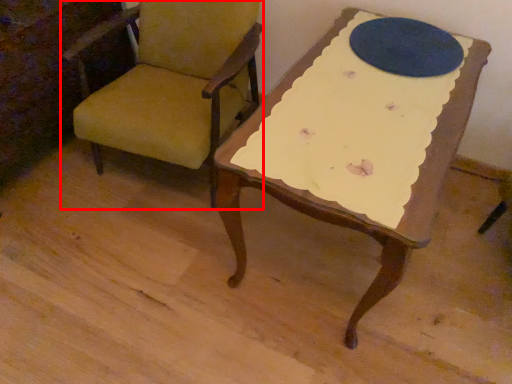
Question: Considering the relative positions of chair (annotated by the red box) and oval in the image provided, where is chair (annotated by the red box) located with respect to the staircase?

Choices:
 (A) right
 (B) left

Answer: (B)